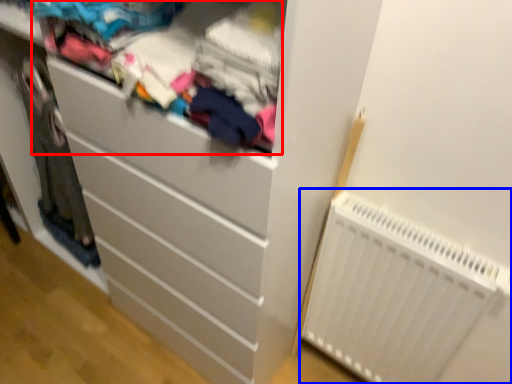
Question: Which of the following is the closest to the observer, clothing (highlighted by a red box) or radiator (highlighted by a blue box)?

Choices:
 (A) clothing
 (B) radiator

Answer: (A)